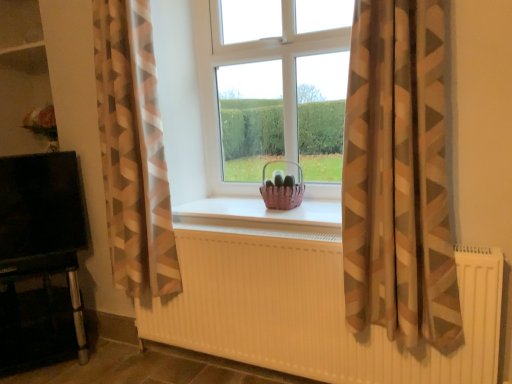
Question: Considering the positions of brown sheer curtain at center, which is the 2th curtain in left-to-right order, and pink woven basket at center in the image, is brown sheer curtain at center, which is the 2th curtain in left-to-right order, bigger or smaller than pink woven basket at center?

Choices:
 (A) small
 (B) big

Answer: (B)

Question: Is brown sheer curtain at center, positioned as the first curtain in right-to-left order, taller or shorter than pink woven basket at center?

Choices:
 (A) tall
 (B) short

Answer: (A)

Question: Based on their relative distances, which object is farther from the black glossy tv at left?

Choices:
 (A) beige-patterned curtain at left, which is the 2th curtain from right to left
 (B) white ribbed radiator at center
 (C) pink woven basket at center
 (D) brown sheer curtain at center, which is the 2th curtain in left-to-right order
 (E) transparent glass window at center

Answer: (D)

Question: Estimate the real-world distances between objects in this image. Which object is farther from the beige-patterned curtain at left, placed as the first curtain when sorted from left to right?

Choices:
 (A) black glossy tv at left
 (B) pink woven basket at center
 (C) transparent glass window at center
 (D) white ribbed radiator at center
 (E) brown sheer curtain at center, positioned as the first curtain in right-to-left order

Answer: (E)